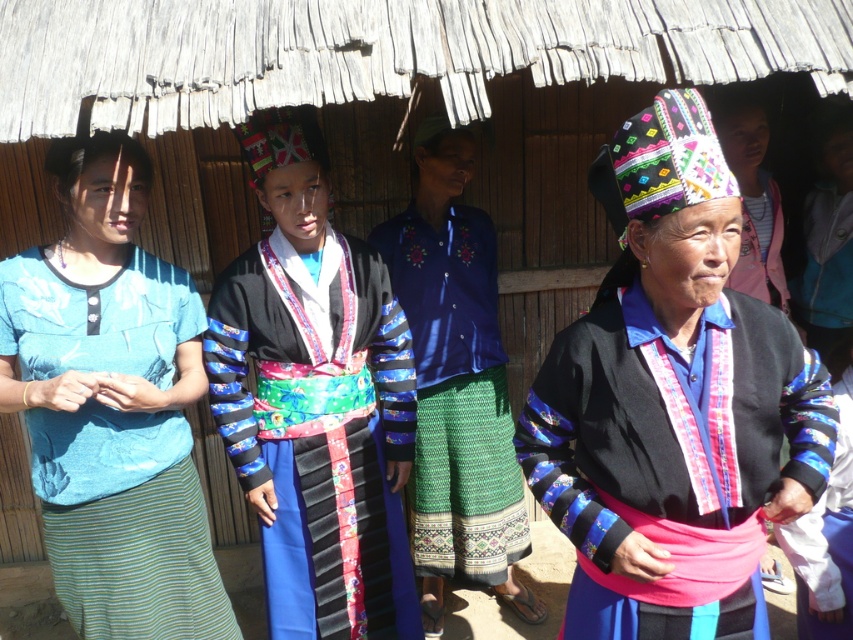
Does blue fabric shirt at center lie behind pink fabric headband at upper right?

Yes, blue fabric shirt at center is further from the viewer.

Between blue fabric shirt at center and pink fabric headband at upper right, which one appears on the left side from the viewer's perspective?

blue fabric shirt at center is more to the left.

Is point (479, 545) positioned behind point (775, 301)?

Yes.

In order to click on blue fabric shirt at center in this screenshot , I will do `click(456, 385)`.

Based on the photo, can you confirm if matte black jacket at center is wider than pink fabric headband at upper right?

Correct, the width of matte black jacket at center exceeds that of pink fabric headband at upper right.

Between matte black jacket at center and pink fabric headband at upper right, which one appears on the right side from the viewer's perspective?

pink fabric headband at upper right

The height and width of the screenshot is (640, 853). What do you see at coordinates (672, 403) in the screenshot?
I see `matte black jacket at center` at bounding box center [672, 403].

What are the coordinates of `matte black jacket at center` in the screenshot? It's located at (672, 403).

Can you confirm if blue fabric shirt at left is positioned to the left of pink fabric headband at upper right?

Indeed, blue fabric shirt at left is positioned on the left side of pink fabric headband at upper right.

What do you see at coordinates (112, 404) in the screenshot? I see `blue fabric shirt at left` at bounding box center [112, 404].

Locate an element on the screen. This screenshot has height=640, width=853. blue fabric shirt at left is located at coordinates (112, 404).